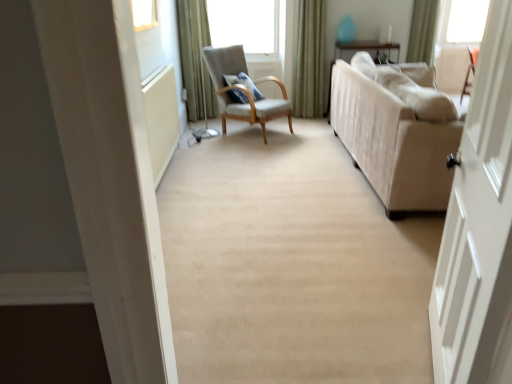
Question: Can you confirm if white wooden door at right is thinner than beige fabric couch at right?

Choices:
 (A) yes
 (B) no

Answer: (A)

Question: From a real-world perspective, does white wooden door at right sit lower than beige fabric couch at right?

Choices:
 (A) no
 (B) yes

Answer: (A)

Question: Is the depth of white wooden door at right greater than that of beige fabric couch at right?

Choices:
 (A) yes
 (B) no

Answer: (B)

Question: Is white wooden door at right not close to beige fabric couch at right?

Choices:
 (A) no
 (B) yes

Answer: (B)

Question: Does white wooden door at right have a greater height compared to beige fabric couch at right?

Choices:
 (A) yes
 (B) no

Answer: (A)

Question: Is white wooden door at right shorter than beige fabric couch at right?

Choices:
 (A) yes
 (B) no

Answer: (B)

Question: Considering the relative positions of green fabric curtain at upper left, which is the first curtain from left to right, and green velvet curtain at upper right, which is the second curtain from left to right, in the image provided, is green fabric curtain at upper left, which is the first curtain from left to right, behind green velvet curtain at upper right, which is the second curtain from left to right,?

Choices:
 (A) no
 (B) yes

Answer: (A)

Question: Is green fabric curtain at upper left, arranged as the third curtain when viewed from the right, outside of green velvet curtain at upper right, which is the second curtain from right to left?

Choices:
 (A) yes
 (B) no

Answer: (A)

Question: Is green fabric curtain at upper left, which is the first curtain from left to right, wider than green velvet curtain at upper right, which is the second curtain from left to right?

Choices:
 (A) yes
 (B) no

Answer: (A)

Question: Is green fabric curtain at upper left, arranged as the third curtain when viewed from the right, oriented away from green velvet curtain at upper right, which is the second curtain from right to left?

Choices:
 (A) no
 (B) yes

Answer: (A)

Question: From the image's perspective, does green fabric curtain at upper left, which is the first curtain from left to right, appear higher than green velvet curtain at upper right, which is the second curtain from left to right?

Choices:
 (A) no
 (B) yes

Answer: (A)

Question: Is green fabric curtain at upper left, which is the first curtain from left to right, smaller than green velvet curtain at upper right, which is the second curtain from right to left?

Choices:
 (A) no
 (B) yes

Answer: (A)

Question: Is beige fabric couch at right closer to the viewer compared to green velvet curtain at upper right, which is the second curtain from left to right?

Choices:
 (A) no
 (B) yes

Answer: (B)